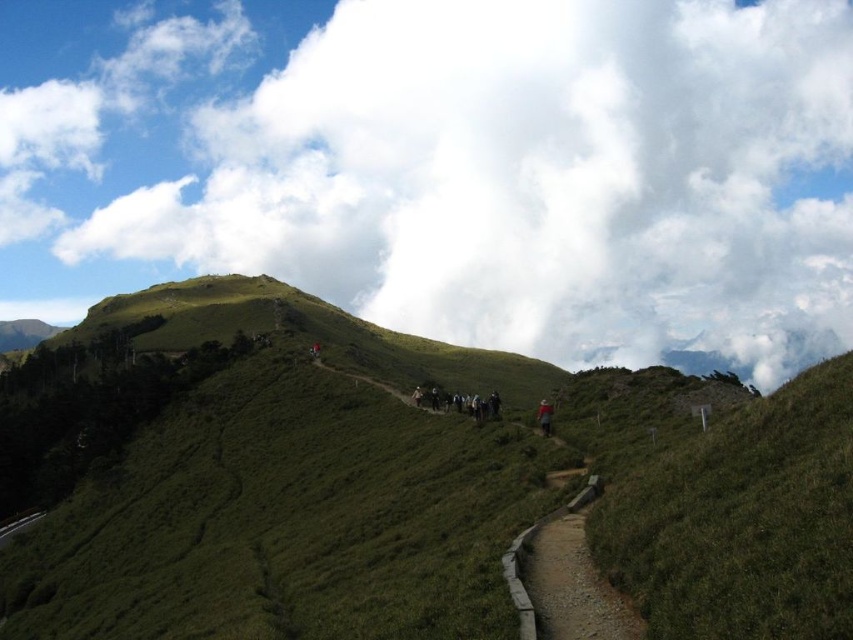
Question: Based on their relative distances, which object is nearer to the red woolen hat at center?

Choices:
 (A) white fluffy cloud at upper center
 (B) brown dirt path at center
 (C) green grassy at upper right

Answer: (B)

Question: Where is dark gray fabric backpacks at center located in relation to red woolen hat at center in the image?

Choices:
 (A) below
 (B) above

Answer: (A)

Question: Considering the real-world distances, which object is closest to the green grassy at upper right?

Choices:
 (A) white fluffy cloud at upper center
 (B) red woolen hat at center

Answer: (B)

Question: Is white fluffy cloud at upper center to the left of brown dirt path at center from the viewer's perspective?

Choices:
 (A) no
 (B) yes

Answer: (B)

Question: Is white fluffy cloud at upper center smaller than green grassy at upper right?

Choices:
 (A) no
 (B) yes

Answer: (A)

Question: Which object is the farthest from the brown dirt path at center?

Choices:
 (A) green grassy at upper right
 (B) dark gray fabric backpacks at center
 (C) white fluffy cloud at upper center

Answer: (C)